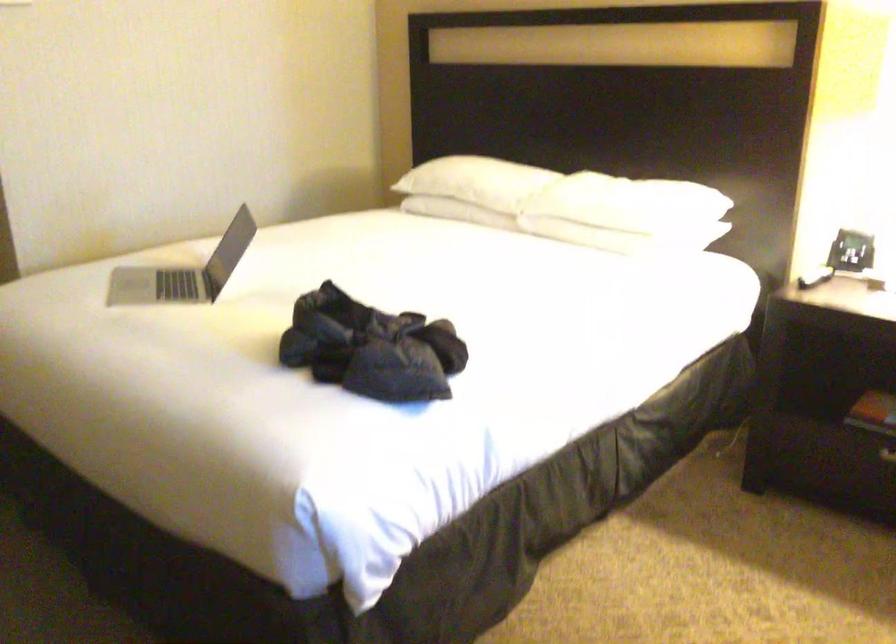
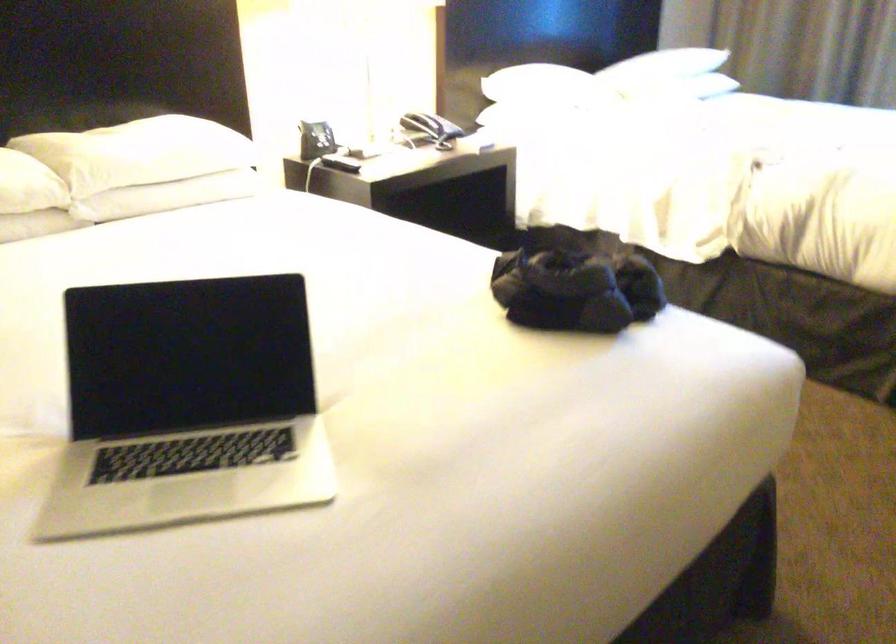
Locate, in the second image, the point that corresponds to the point at 631,192 in the first image.

(186, 136)